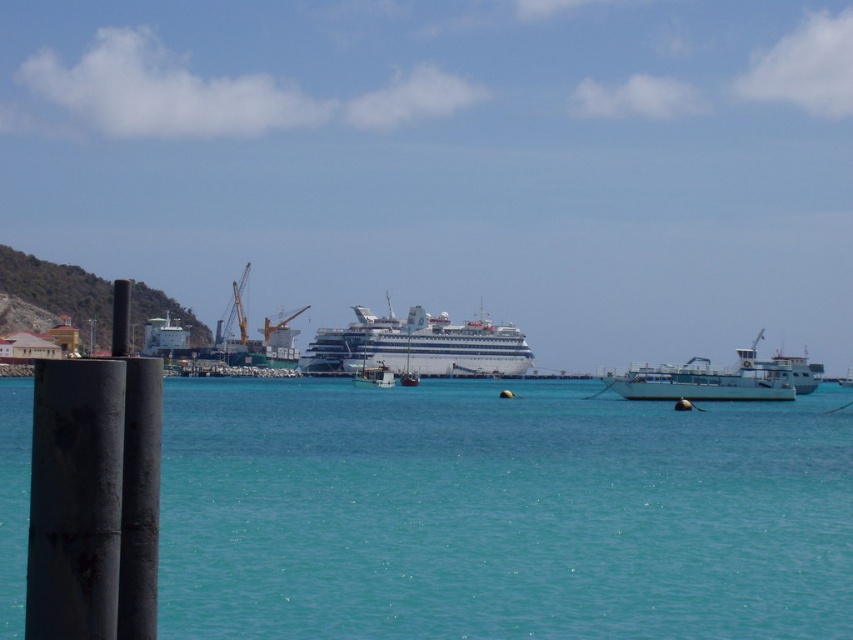
Does white glossy cruise ship at center have a smaller size compared to white matte boat at right?

Yes, white glossy cruise ship at center is smaller than white matte boat at right.

Which is more to the right, white glossy cruise ship at center or white matte boat at right?

white matte boat at right

Between point (415, 369) and point (787, 380), which one is positioned behind?

The point (415, 369) is more distant.

Where is `white glossy cruise ship at center`? This screenshot has height=640, width=853. white glossy cruise ship at center is located at coordinates (416, 346).

Can you confirm if clear blue water at center is positioned above white matte boat at right?

No, clear blue water at center is not above white matte boat at right.

Can you confirm if clear blue water at center is taller than white matte boat at right?

Yes.

Which is in front, point (196, 493) or point (743, 374)?

Positioned in front is point (196, 493).

At what (x,y) coordinates should I click in order to perform the action: click on clear blue water at center. Please return your answer as a coordinate pair (x, y). This screenshot has height=640, width=853. Looking at the image, I should click on [x=498, y=513].

Is clear blue water at center positioned at the back of white glossy cruise ship at center?

No, it is not.

Does point (316, 522) lie in front of point (407, 333)?

Yes, it is in front of point (407, 333).

Where is `clear blue water at center`? This screenshot has width=853, height=640. clear blue water at center is located at coordinates (498, 513).